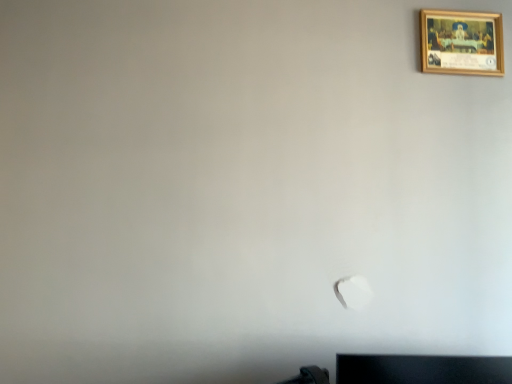
The height and width of the screenshot is (384, 512). What do you see at coordinates (461, 42) in the screenshot?
I see `wooden picture frame at upper right` at bounding box center [461, 42].

I want to click on wooden picture frame at upper right, so click(x=461, y=42).

Identify the location of wooden picture frame at upper right. (461, 42).